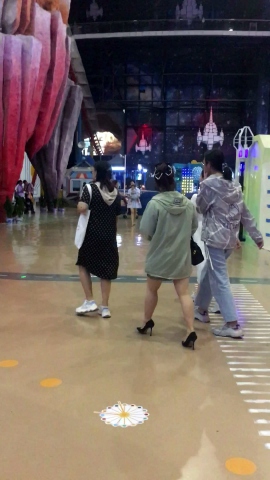
Locate an element on the screen. This screenshot has width=270, height=480. ceiling is located at coordinates (136, 12).